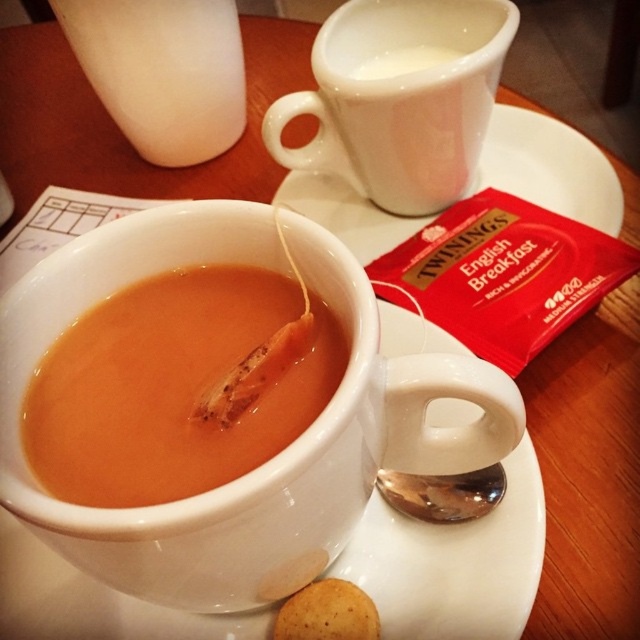
Looking at this image, you are arranging a tea set on a table and need to place a new saucer at the exact coordinates of point (548, 168). Is there already an object at that location?

Yes, the white ceramic saucer at upper center is located at point (548, 168).

You are a tea enthusiast who wants to place a new teacup on the table. The new teacup has a diameter of 10 centimeters. Considering the distance between the white ceramic saucer at upper center and the white glossy cup at upper center, can you fit the new teacup between them without overlapping?

The distance between the white ceramic saucer at upper center and the white glossy cup at upper center is 15.46 centimeters. Since the new teacup has a diameter of 10 centimeters, which is smaller than the 15.46 cm gap, it can fit between them without overlapping.